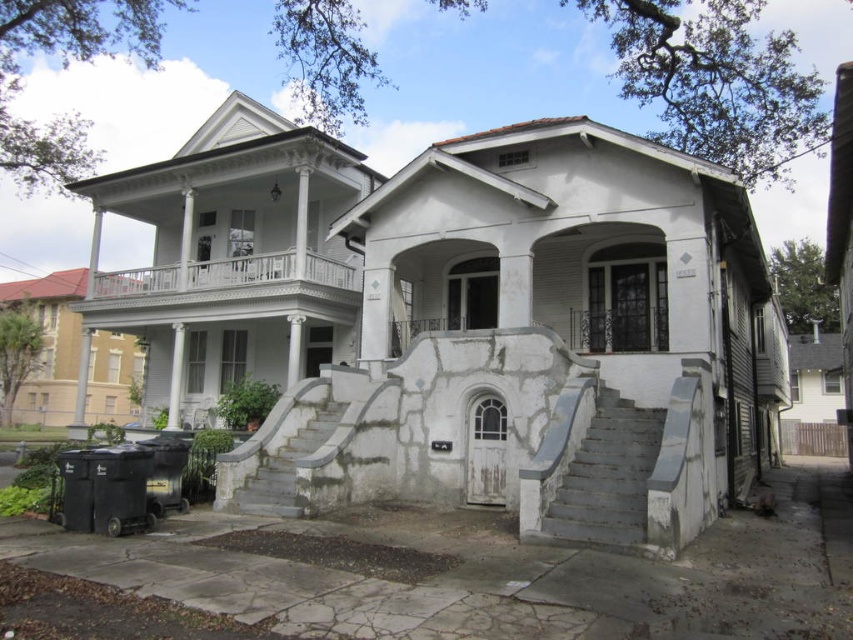
From the picture: Is gray concrete stairs at lower right behind gray concrete stairs at center?

That is False.

The width and height of the screenshot is (853, 640). What are the coordinates of `gray concrete stairs at lower right` in the screenshot? It's located at (607, 477).

You are a GUI agent. You are given a task and a screenshot of the screen. Output one action in this format:
    pyautogui.click(x=<x>, y=<y>)
    Task: Click on the gray concrete stairs at lower right
    
    Given the screenshot: What is the action you would take?
    pos(607,477)

Between point (297, 256) and point (273, 513), which one is positioned in front?

Point (273, 513) is more forward.

Between white painted wood porch at upper center and gray concrete stairs at center, which one is positioned lower?

Positioned lower is gray concrete stairs at center.

Does point (189, 289) lie in front of point (270, 486)?

That is False.

Find the location of a particular element. white painted wood porch at upper center is located at coordinates (229, 280).

Which is behind, point (608, 445) or point (225, 260)?

The point (225, 260) is behind.

Who is more distant from viewer, (628, 538) or (149, 288)?

The point (149, 288) is behind.

What are the coordinates of `gray concrete stairs at lower right` in the screenshot? It's located at pyautogui.click(x=607, y=477).